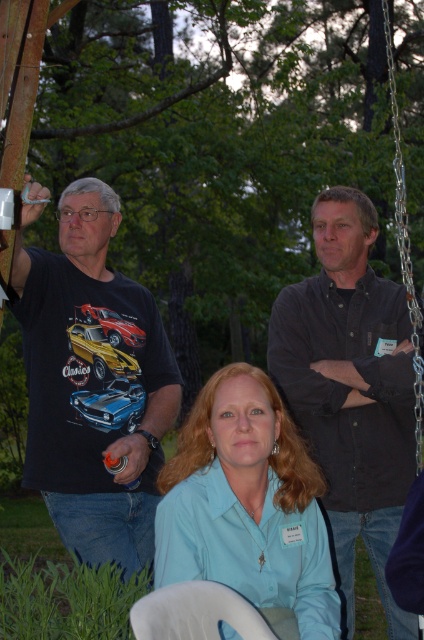
You are observing an outdoor gathering and notice two people wearing different colored shirts. The dark gray shirt at upper right and the light blue shirt at center. Which person is positioned higher in the image?

The dark gray shirt at upper right is positioned higher in the image than the light blue shirt at center.